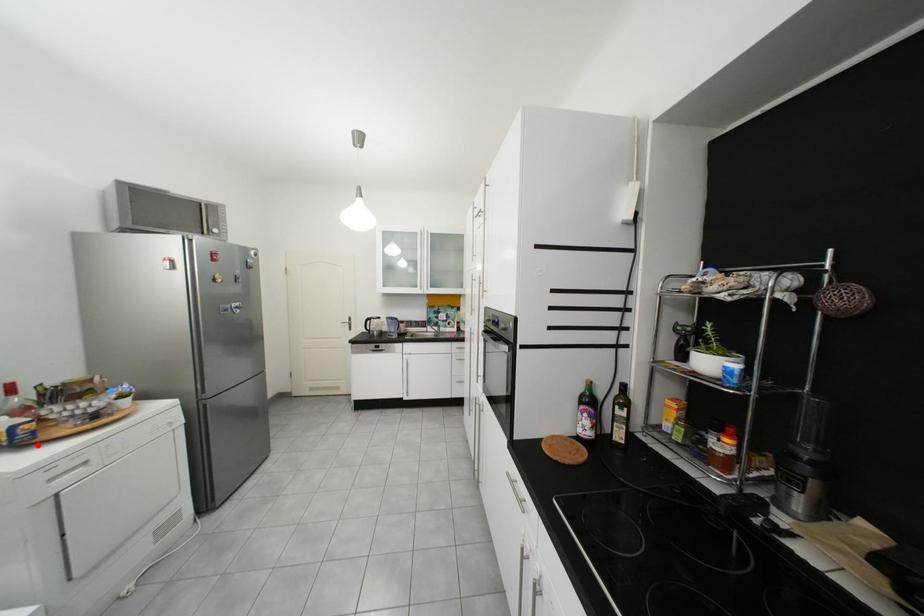
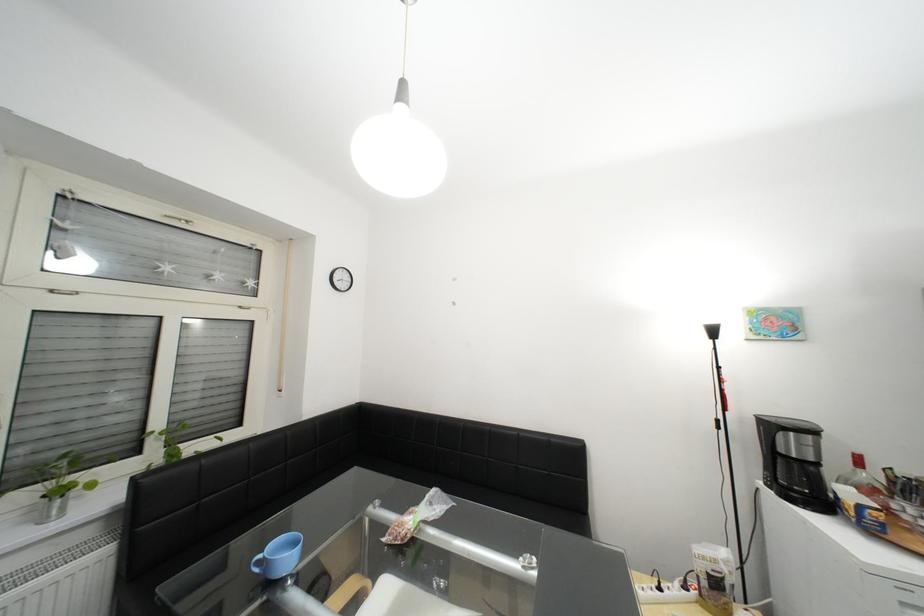
Question: A red point is marked in image1. In image2, is the corresponding 3D point closer to the camera or farther? Reply with the corresponding letter.

Choices:
 (A) The corresponding 3D point is closer.
 (B) The corresponding 3D point is farther.

Answer: (A)